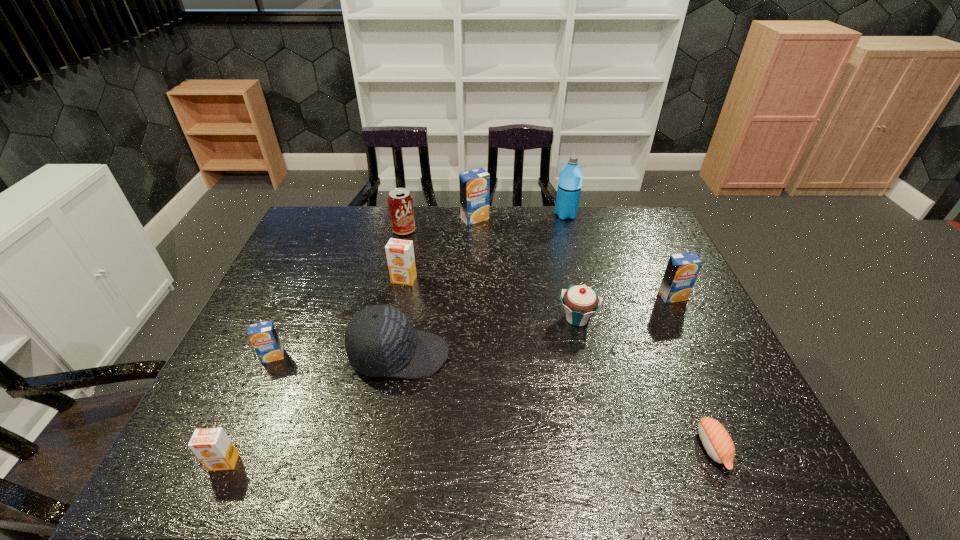
At what (x,y) coordinates should I click in order to perform the action: click on thermos bottle. Please return your answer as a coordinate pair (x, y). The width and height of the screenshot is (960, 540). Looking at the image, I should click on (571, 175).

The height and width of the screenshot is (540, 960). Identify the location of the farthest orange juice. (475, 184).

Where is `the farthest blue orange_juice`? The width and height of the screenshot is (960, 540). the farthest blue orange_juice is located at coordinates (475, 184).

The image size is (960, 540). Find the location of `soda can`. soda can is located at coordinates (400, 202).

This screenshot has width=960, height=540. What are the coordinates of `the right orange orange juice` in the screenshot? It's located at (400, 253).

You are a GUI agent. You are given a task and a screenshot of the screen. Output one action in this format:
    pyautogui.click(x=<x>, y=<y>)
    Task: Click on the farther orange orange juice
    
    Given the screenshot: What is the action you would take?
    pyautogui.click(x=400, y=253)

The height and width of the screenshot is (540, 960). Identify the location of the fifth farthest object. (682, 270).

The image size is (960, 540). Find the location of `the second farthest blue orange_juice`. the second farthest blue orange_juice is located at coordinates (682, 270).

You are a GUI agent. You are given a task and a screenshot of the screen. Output one action in this format:
    pyautogui.click(x=<x>, y=<y>)
    Task: Click on the baseball cap
    The height and width of the screenshot is (540, 960).
    Given the screenshot: What is the action you would take?
    pyautogui.click(x=380, y=341)

Find the location of a particular element. Image resolution: width=960 pixels, height=540 pixels. cupcake is located at coordinates coord(580,302).